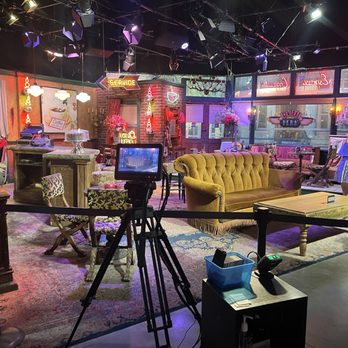
Image resolution: width=348 pixels, height=348 pixels. Identify the location of arm of couch. (206, 184), (291, 172).